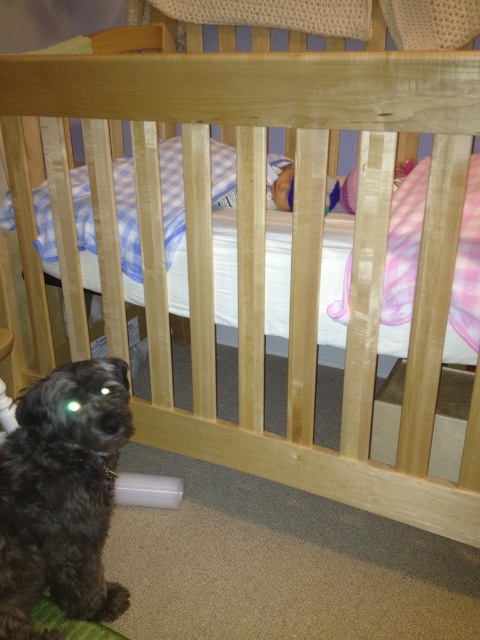
Question: Which of the following is the closest to the observer?

Choices:
 (A) pink satin baby at center
 (B) black fuzzy dog at lower left

Answer: (B)

Question: Which point is closer to the camera?

Choices:
 (A) (267, 202)
 (B) (14, 538)

Answer: (B)

Question: Is black fuzzy dog at lower left above pink satin baby at center?

Choices:
 (A) yes
 (B) no

Answer: (B)

Question: Is black fuzzy dog at lower left closer to the viewer compared to pink satin baby at center?

Choices:
 (A) yes
 (B) no

Answer: (A)

Question: Is black fuzzy dog at lower left thinner than pink satin baby at center?

Choices:
 (A) no
 (B) yes

Answer: (B)

Question: Among these objects, which one is farthest from the camera?

Choices:
 (A) pink satin baby at center
 (B) black fuzzy dog at lower left

Answer: (A)